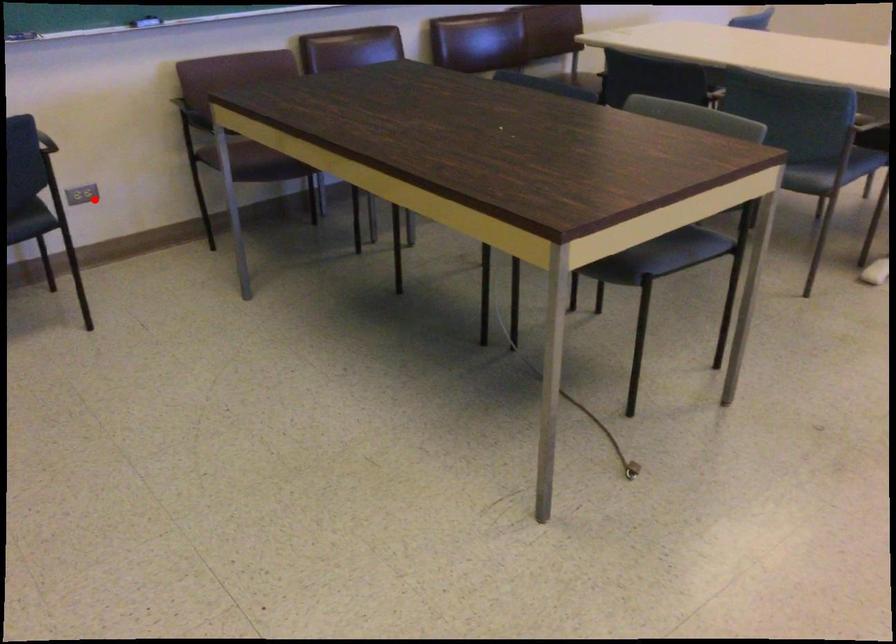
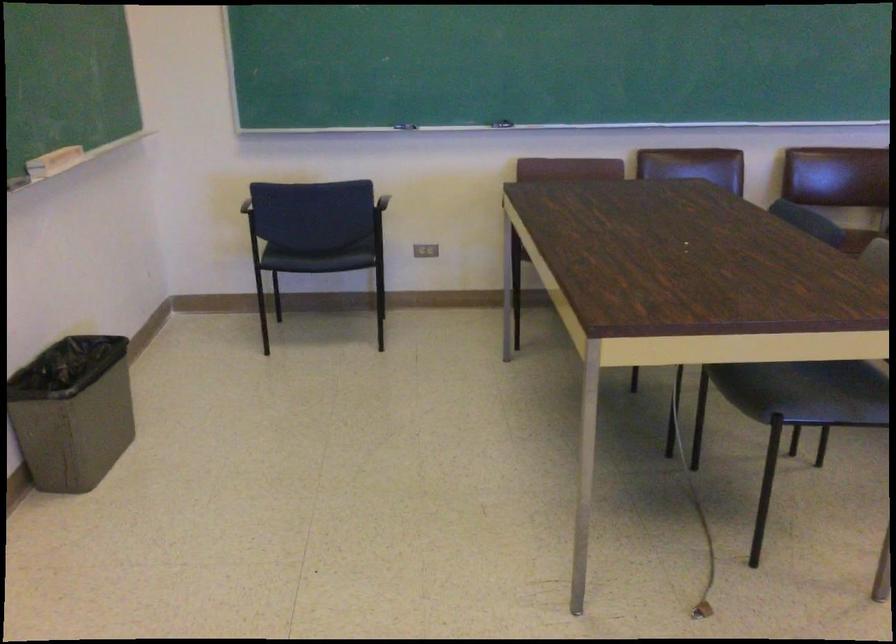
Question: I am providing you with two images of the same scene from different viewpoints. A red point is marked on the first image. Can you still see the location of the red point in image 2?

Choices:
 (A) Yes
 (B) No

Answer: (A)